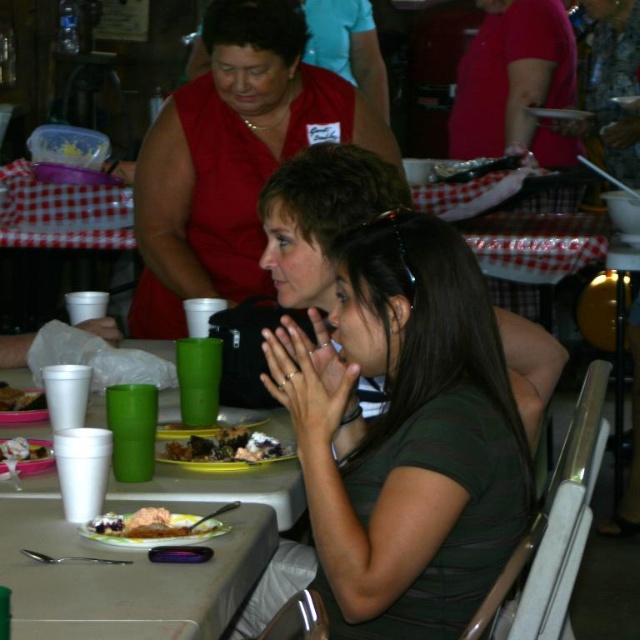
Question: Can you confirm if dark green fabric shirt at center is smaller than shiny plastic fork at upper left?

Choices:
 (A) yes
 (B) no

Answer: (B)

Question: Is white creamy dessert at lower left to the left of shiny plastic fork at upper left from the viewer's perspective?

Choices:
 (A) no
 (B) yes

Answer: (A)

Question: Which point appears farthest from the camera in this image?

Choices:
 (A) (42, 394)
 (B) (150, 170)
 (C) (518, 384)
 (D) (237, 474)

Answer: (B)

Question: Which object is positioned farthest from the matte green cup at upper center?

Choices:
 (A) green matte shirt at center
 (B) dark green fabric shirt at center

Answer: (A)

Question: Does yellowish matte plate at lower left come in front of white creamy dessert at lower left?

Choices:
 (A) yes
 (B) no

Answer: (A)

Question: Which of the following is the farthest from the observer?

Choices:
 (A) (0, 444)
 (B) (224, 541)
 (C) (502, 316)
 (D) (256, 275)

Answer: (D)